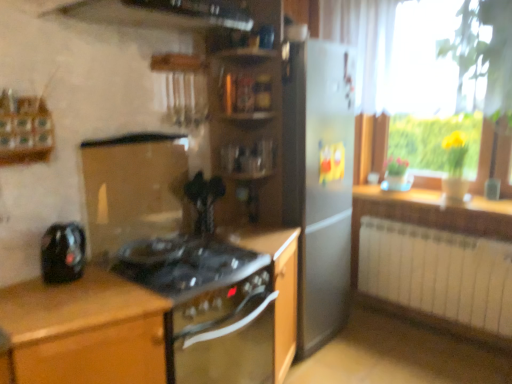
Question: Is black glass gas stove at center wider than wooden countertop at right?

Choices:
 (A) no
 (B) yes

Answer: (B)

Question: Is black glass gas stove at center thinner than wooden countertop at right?

Choices:
 (A) no
 (B) yes

Answer: (A)

Question: From the image's perspective, is black glass gas stove at center on wooden countertop at right?

Choices:
 (A) yes
 (B) no

Answer: (B)

Question: Does black glass gas stove at center come in front of wooden countertop at right?

Choices:
 (A) no
 (B) yes

Answer: (B)

Question: From a real-world perspective, is black glass gas stove at center on wooden countertop at right?

Choices:
 (A) yes
 (B) no

Answer: (A)

Question: From the image's perspective, is wooden countertop at right above or below black glass stove at center, which is the 2th cabinetry from left to right?

Choices:
 (A) below
 (B) above

Answer: (B)

Question: Which is correct: wooden countertop at right is inside black glass stove at center, placed as the second cabinetry when sorted from right to left, or outside of it?

Choices:
 (A) inside
 (B) outside

Answer: (B)

Question: Looking at their shapes, would you say wooden countertop at right is wider or thinner than black glass stove at center, which is the 2th cabinetry from left to right?

Choices:
 (A) thin
 (B) wide

Answer: (A)

Question: In the image, is wooden countertop at right positioned in front of or behind black glass stove at center, which is the 2th cabinetry from left to right?

Choices:
 (A) front
 (B) behind

Answer: (B)

Question: Considering the relative positions of wooden countertop at right and white metallic radiator at lower right in the image provided, is wooden countertop at right to the left or to the right of white metallic radiator at lower right?

Choices:
 (A) left
 (B) right

Answer: (B)

Question: From the image's perspective, relative to white metallic radiator at lower right, is wooden countertop at right above or below?

Choices:
 (A) below
 (B) above

Answer: (B)

Question: Is wooden countertop at right bigger or smaller than white metallic radiator at lower right?

Choices:
 (A) small
 (B) big

Answer: (A)

Question: Considering the positions of point (388, 192) and point (453, 253), is point (388, 192) closer or farther from the camera than point (453, 253)?

Choices:
 (A) closer
 (B) farther

Answer: (B)

Question: In terms of width, does white metallic radiator at lower right look wider or thinner when compared to yellow glass vase at right?

Choices:
 (A) thin
 (B) wide

Answer: (B)

Question: Is white metallic radiator at lower right inside or outside of yellow glass vase at right?

Choices:
 (A) outside
 (B) inside

Answer: (A)